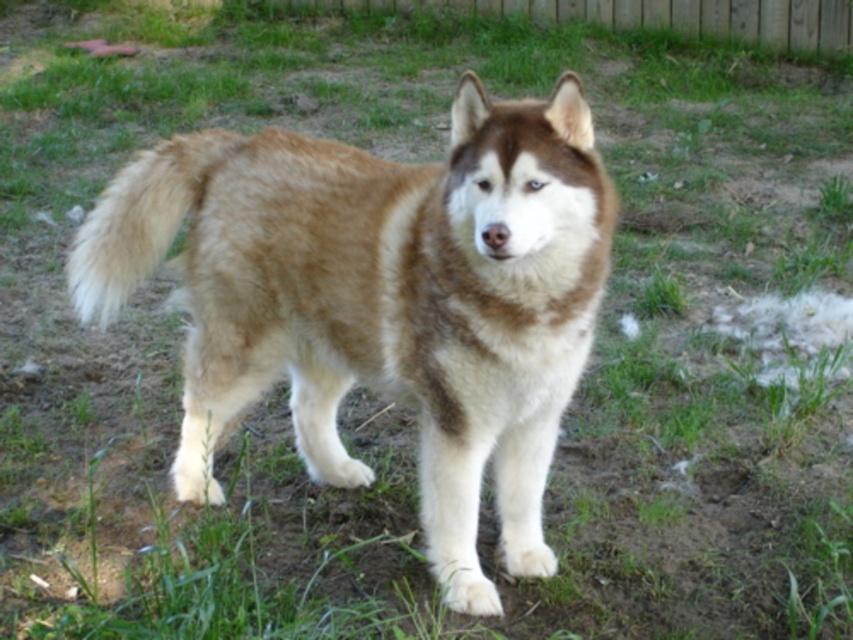
Based on the photo, is brown/white fur dog at center above wooden fence at upper center?

No.

Between point (309, 396) and point (717, 26), which one is positioned in front?

Point (309, 396) is in front.

Does point (578, 273) lie in front of point (751, 33)?

Yes.

Identify the location of brown/white fur dog at center. (380, 300).

Is fuzzy brown fur at rear shorter than wooden fence at upper center?

Incorrect, fuzzy brown fur at rear's height does not fall short of wooden fence at upper center's.

Between point (190, 176) and point (665, 22), which one is positioned in front?

Point (190, 176)

Does point (73, 301) come closer to viewer compared to point (585, 19)?

Yes, it is.

This screenshot has height=640, width=853. I want to click on fuzzy brown fur at rear, so click(138, 220).

Which is above, brown/white fur dog at center or fuzzy brown fur at rear?

fuzzy brown fur at rear

Between brown/white fur dog at center and fuzzy brown fur at rear, which one is positioned lower?

brown/white fur dog at center is below.

Find the location of a particular element. The width and height of the screenshot is (853, 640). brown/white fur dog at center is located at coordinates (380, 300).

Locate an element on the screen. Image resolution: width=853 pixels, height=640 pixels. brown/white fur dog at center is located at coordinates [x=380, y=300].